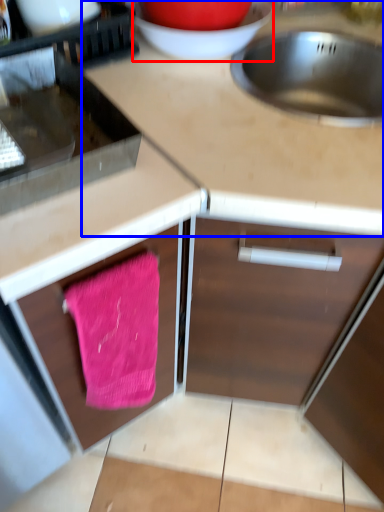
Question: Among these objects, which one is farthest to the camera, basin (highlighted by a red box) or countertop (highlighted by a blue box)?

Choices:
 (A) basin
 (B) countertop

Answer: (A)